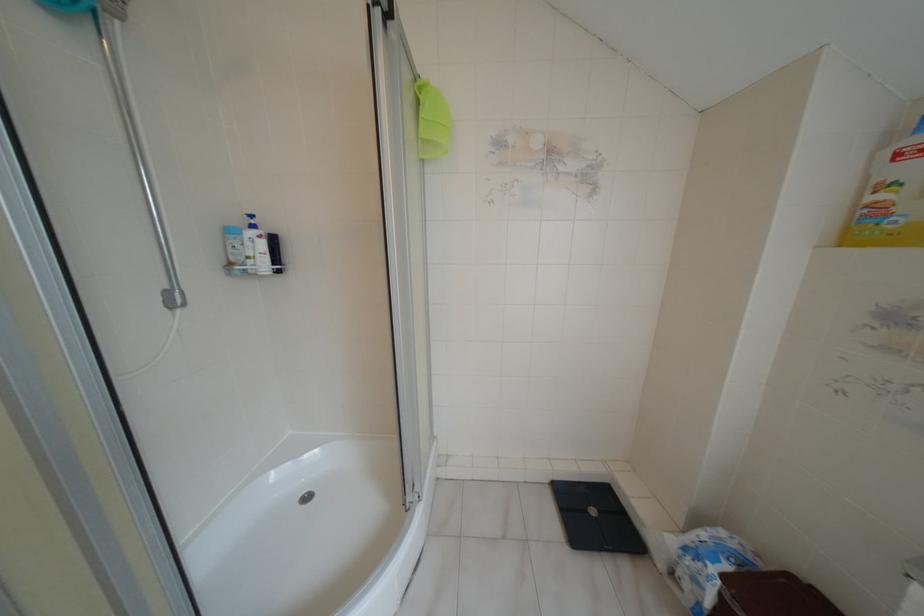
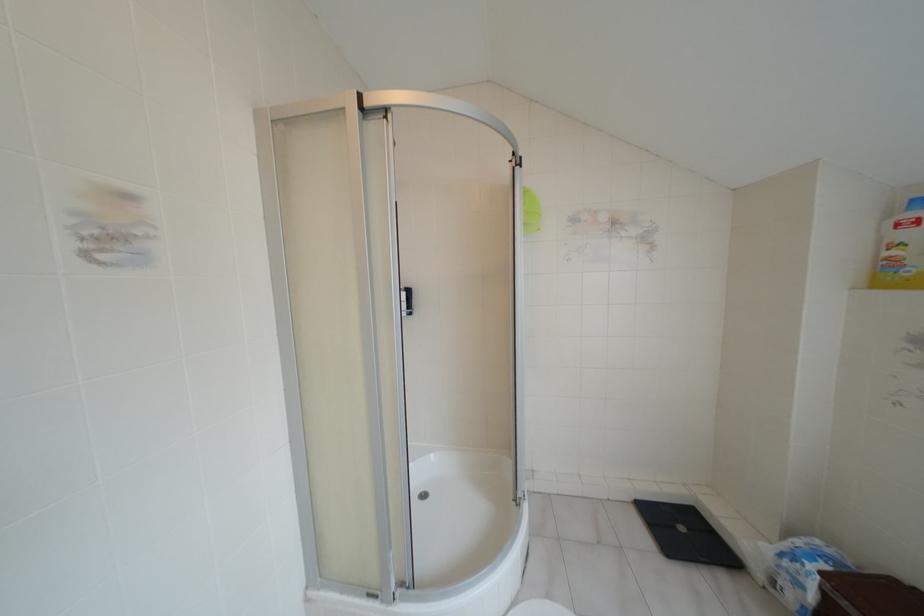
What movement of the cameraman would produce the second image?

The movement direction of the cameraman is left, backward.